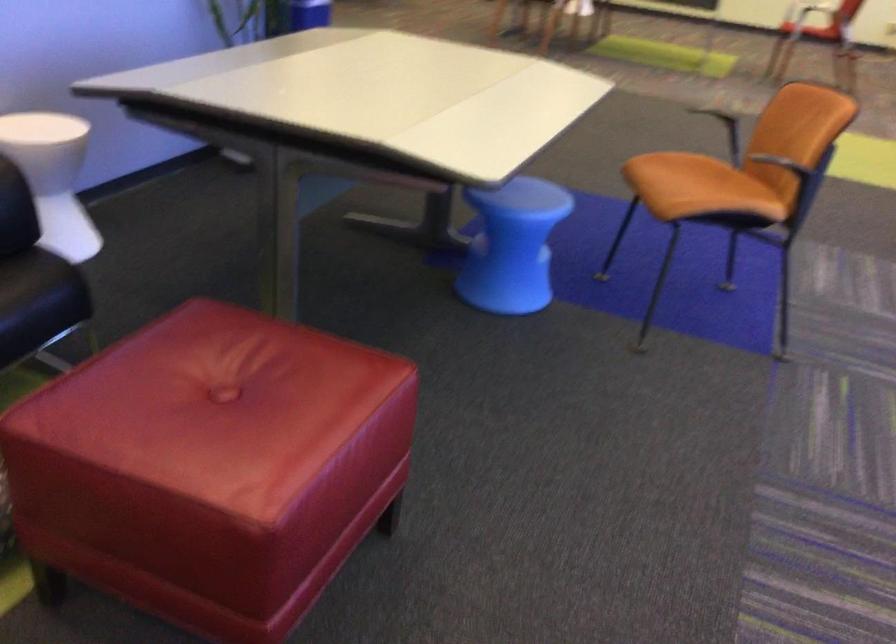
Where would you sit the black chair sitting surface? Please return your answer as a coordinate pair (x, y).

(28, 279)